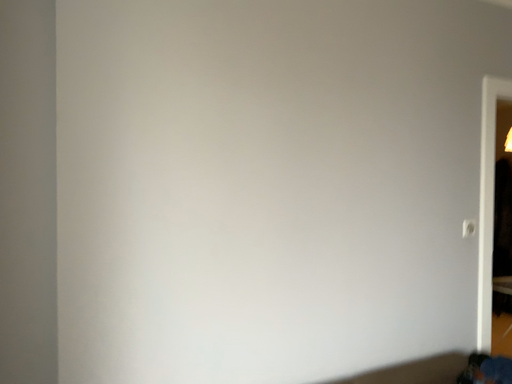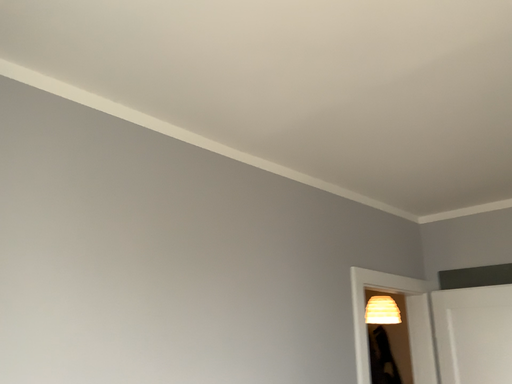
Question: Which way did the camera rotate in the video?

Choices:
 (A) rotated upward
 (B) rotated downward

Answer: (A)